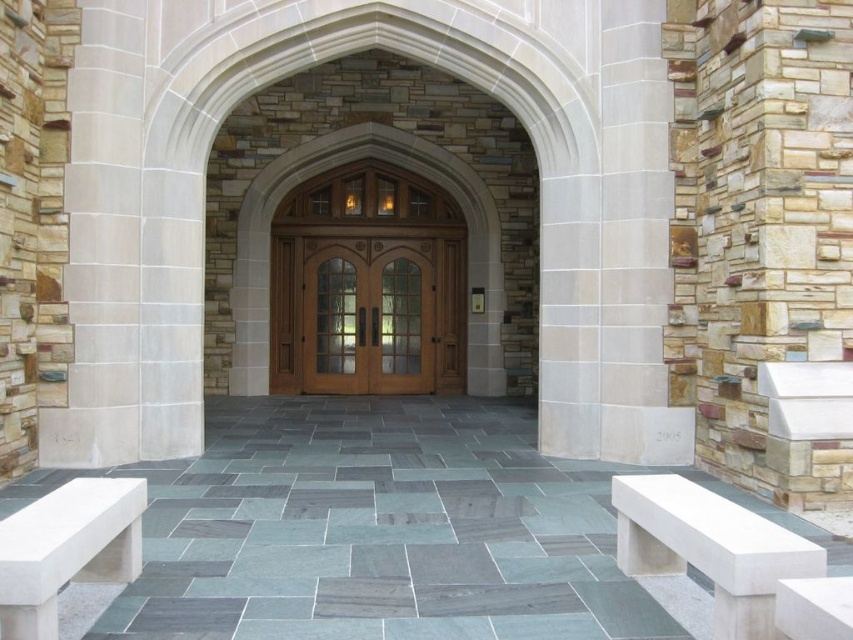
Question: Which of the following is the closest to the observer?

Choices:
 (A) (820, 584)
 (B) (630, 531)
 (C) (123, 531)
 (D) (350, 273)

Answer: (A)

Question: Is mahogany wood double doors at center below white smooth bench at lower right?

Choices:
 (A) no
 (B) yes

Answer: (A)

Question: Can you confirm if white stone bench at lower right is thinner than white stone bench at lower left?

Choices:
 (A) yes
 (B) no

Answer: (B)

Question: Based on their relative distances, which object is farther from the white smooth bench at lower right?

Choices:
 (A) white stone bench at lower left
 (B) mahogany wood double doors at center
 (C) white stone bench at lower right

Answer: (B)

Question: Can you confirm if white stone bench at lower left is bigger than white smooth bench at lower right?

Choices:
 (A) yes
 (B) no

Answer: (A)

Question: Which point is closer to the camera?

Choices:
 (A) (724, 556)
 (B) (125, 513)

Answer: (A)